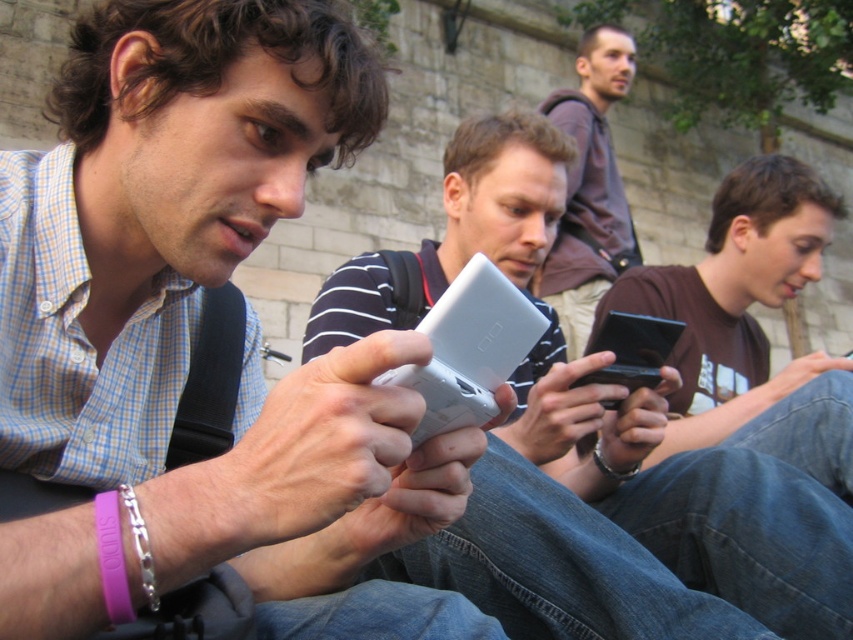
You are standing in a park and see the silver plastic phone at center and the brown hoodie at upper center. If you want to pick up the phone without moving closer than 8 meters to the hoodie, is it possible?

The silver plastic phone at center and the brown hoodie at upper center are 8.19 meters apart. Since you need to stay at least 8 meters away from the hoodie, you can pick up the phone as the distance is sufficient.

You are a photographer trying to capture the matte white phone at center in your shot. Given that your camera has a focal point at coordinates 0.5, 0.5, will the phone be in focus?

The matte white phone at center is at coordinates (192, 337), which is close to the camera focal point at (426, 320). Therefore, the phone will likely be in focus.